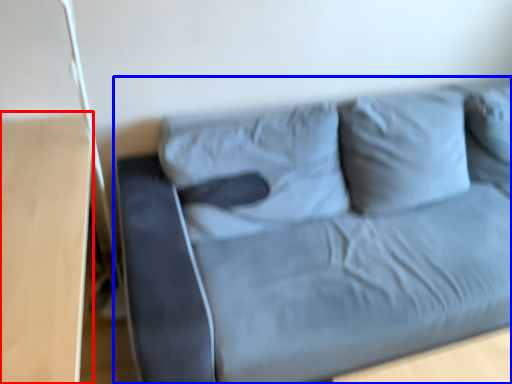
Question: Which point is closer to the camera, table (highlighted by a red box) or studio couch (highlighted by a blue box)?

Choices:
 (A) table
 (B) studio couch

Answer: (A)